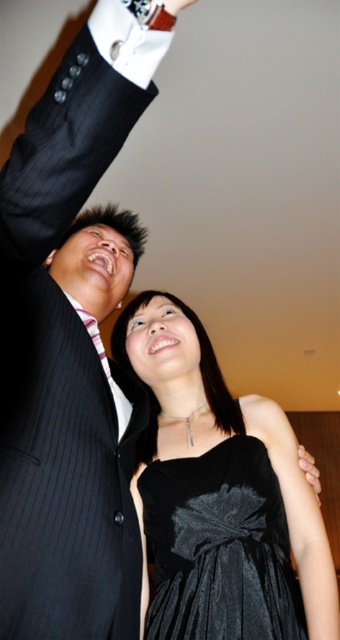
Consider the image. You are a photographer at a formal event. You need to position two guests wearing the velvet black dress at lower center and the matte black dress at lower center for a group photo. According to the scene, which dress is positioned to the left of the other?

The velvet black dress at lower center is positioned to the left of the matte black dress at lower center.

You are standing in the banquet hall and want to move from the point at coordinates point (192, 477) to the point at coordinates point (304, 472). Can you walk directly between them without needing to go around any obstacles?

Point (192, 477) is in front of point (304, 472), so there is no obstacle blocking the path between them. You can walk directly between them.